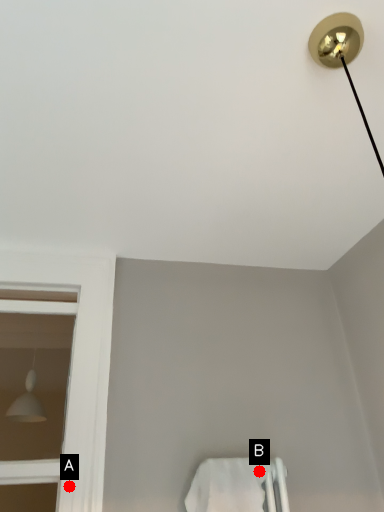
Question: Two points are circled on the image, labeled by A and B beside each circle. Among these points, which one is farthest from the camera?

Choices:
 (A) A is further
 (B) B is further

Answer: (B)